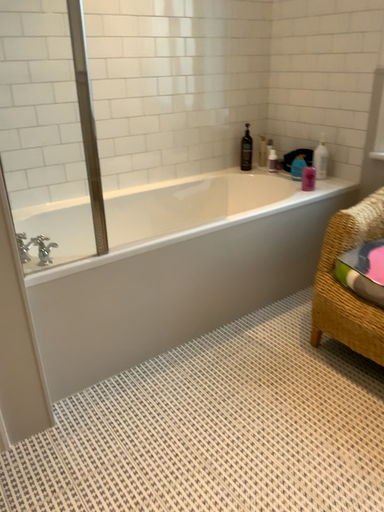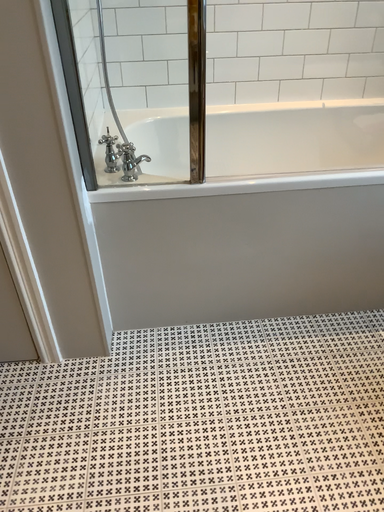
Question: How did the camera likely rotate when shooting the video?

Choices:
 (A) rotated right
 (B) rotated left

Answer: (B)